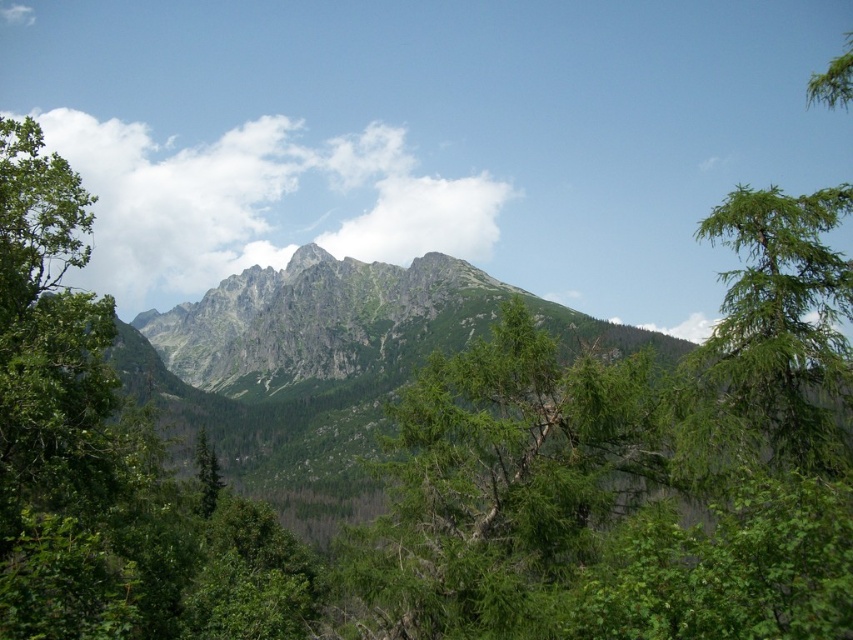
Who is higher up, green needle-like tree at center or green needle-like tree at right?

green needle-like tree at right

Does point (421, 451) come closer to viewer compared to point (740, 349)?

No.

In order to click on green needle-like tree at center in this screenshot , I will do `click(500, 486)`.